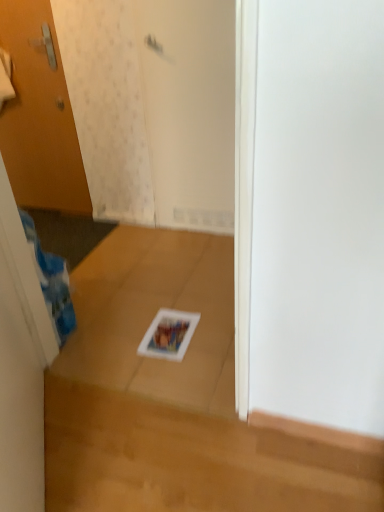
Find the location of `matte white magazine at center`. matte white magazine at center is located at coordinates (169, 334).

At what (x,y) coordinates should I click in order to perform the action: click on wooden door at left. Please return your answer as a coordinate pair (x, y). The image size is (384, 512). Looking at the image, I should click on (39, 115).

At what (x,y) coordinates should I click in order to perform the action: click on matte white magazine at center. Please return your answer as a coordinate pair (x, y). The width and height of the screenshot is (384, 512). Looking at the image, I should click on (169, 334).

Does matte white magazine at center touch white matte screen door at upper center?

matte white magazine at center is not next to white matte screen door at upper center, and they're not touching.

Could you tell me if matte white magazine at center is facing white matte screen door at upper center?

No, matte white magazine at center is not oriented towards white matte screen door at upper center.

Which object is positioned more to the left, matte white magazine at center or white matte screen door at upper center?

Positioned to the left is matte white magazine at center.

Is matte white magazine at center wider or thinner than white matte screen door at upper center?

Clearly, matte white magazine at center has more width compared to white matte screen door at upper center.

From the picture: Could you tell me if wooden door at left is turned towards white matte screen door at upper center?

No, wooden door at left is not turned towards white matte screen door at upper center.

Locate an element on the screen. door lying above the white matte screen door at upper center (from the image's perspective) is located at coordinates (39, 115).

Is wooden door at left situated inside white matte screen door at upper center or outside?

wooden door at left is located beyond the bounds of white matte screen door at upper center.

Is wooden door at left to the left or to the right of white matte screen door at upper center in the image?

Clearly, wooden door at left is on the left of white matte screen door at upper center in the image.

Is matte white magazine at center located within white matte screen door at upper center?

No, white matte screen door at upper center does not contain matte white magazine at center.

Is there a large distance between white matte screen door at upper center and matte white magazine at center?

white matte screen door at upper center is far away from matte white magazine at center.

Considering the relative sizes of white matte screen door at upper center and matte white magazine at center in the image provided, is white matte screen door at upper center bigger than matte white magazine at center?

Yes, white matte screen door at upper center is bigger than matte white magazine at center.

Does white matte screen door at upper center have a lesser height compared to matte white magazine at center?

In fact, white matte screen door at upper center may be taller than matte white magazine at center.

Is matte white magazine at center looking in the opposite direction of wooden door at left?

matte white magazine at center does not have its back to wooden door at left.

In the image, there is a wooden door at left. In order to click on magazine below it (from the image's perspective) in this screenshot , I will do `click(169, 334)`.

Considering the relative positions of matte white magazine at center and wooden door at left in the image provided, is matte white magazine at center to the right of wooden door at left from the viewer's perspective?

Indeed, matte white magazine at center is positioned on the right side of wooden door at left.

Based on the photo, from the image's perspective, which is below, matte white magazine at center or wooden door at left?

matte white magazine at center.

How distant is wooden door at left from matte white magazine at center?

wooden door at left is 4.95 feet from matte white magazine at center.

Consider the image. Is wooden door at left oriented away from matte white magazine at center?

No, matte white magazine at center is not at the back of wooden door at left.

In the scene shown: What's the angular difference between wooden door at left and matte white magazine at center's facing directions?

The angle between the facing direction of wooden door at left and the facing direction of matte white magazine at center is 179 degrees.

Considering the sizes of objects wooden door at left and matte white magazine at center in the image provided, who is bigger, wooden door at left or matte white magazine at center?

wooden door at left.

You are a GUI agent. You are given a task and a screenshot of the screen. Output one action in this format:
    pyautogui.click(x=<x>, y=<y>)
    Task: Click on the door behind the white matte screen door at upper center
    
    Given the screenshot: What is the action you would take?
    pyautogui.click(x=39, y=115)

Is white matte screen door at upper center outside of wooden door at left?

That's correct, white matte screen door at upper center is outside of wooden door at left.

Based on the photo, is white matte screen door at upper center positioned before wooden door at left?

Yes, white matte screen door at upper center is closer to the viewer.

Where is `screen door located above the matte white magazine at center (from the image's perspective)`? This screenshot has width=384, height=512. screen door located above the matte white magazine at center (from the image's perspective) is located at coordinates (190, 109).

Where is `screen door below the wooden door at left (from the image's perspective)`? screen door below the wooden door at left (from the image's perspective) is located at coordinates click(x=190, y=109).

Which object lies further to the anchor point wooden door at left, white matte screen door at upper center or matte white magazine at center?

matte white magazine at center is further to wooden door at left.

Based on their spatial positions, is wooden door at left or matte white magazine at center further from white matte screen door at upper center?

The object further to white matte screen door at upper center is matte white magazine at center.

Based on their spatial positions, is matte white magazine at center or wooden door at left further from white matte screen door at upper center?

Among the two, matte white magazine at center is located further to white matte screen door at upper center.

Looking at this image, which object lies nearer to the anchor point matte white magazine at center, white matte screen door at upper center or wooden door at left?

white matte screen door at upper center is positioned closer to the anchor matte white magazine at center.

Estimate the real-world distances between objects in this image. Which object is further from matte white magazine at center, wooden door at left or white matte screen door at upper center?

wooden door at left lies further to matte white magazine at center than the other object.

Estimate the real-world distances between objects in this image. Which object is further from wooden door at left, matte white magazine at center or white matte screen door at upper center?

Among the two, matte white magazine at center is located further to wooden door at left.

Locate an element on the screen. screen door between wooden door at left and matte white magazine at center vertically is located at coordinates (190, 109).